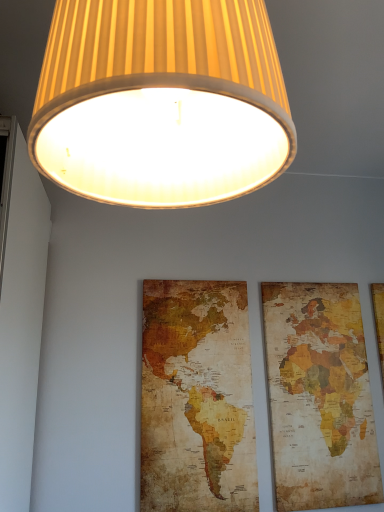
Measure the distance between point (x=360, y=501) and camera.

1.52 meters.

The image size is (384, 512). Describe the element at coordinates (197, 398) in the screenshot. I see `vintage paper map at center` at that location.

I want to click on matte yellow fabric lampshade at upper center, so click(x=161, y=101).

How different are the orientations of matte yellow fabric lampshade at upper center and vintage paper map at center in degrees?

The angle between the facing direction of matte yellow fabric lampshade at upper center and the facing direction of vintage paper map at center is 90.9 degrees.

Is matte yellow fabric lampshade at upper center shorter than vintage paper map at center?

Correct, matte yellow fabric lampshade at upper center is not as tall as vintage paper map at center.

Is matte yellow fabric lampshade at upper center aimed at vintage paper map at center?

No, matte yellow fabric lampshade at upper center is not facing towards vintage paper map at center.

From the image's perspective, is matte yellow fabric lampshade at upper center beneath vintage paper map at center?

No.

Is the surface of vintage paper map at right in direct contact with vintage paper map at center?

No.

From the image's perspective, is vintage paper map at right located above or below vintage paper map at center?

vintage paper map at right is below vintage paper map at center.

From a real-world perspective, is vintage paper map at right below vintage paper map at center?

Correct, in the physical world, vintage paper map at right is lower than vintage paper map at center.

How many degrees apart are the facing directions of vintage paper map at right and vintage paper map at center?

0.936 degrees separate the facing orientations of vintage paper map at right and vintage paper map at center.

Does vintage paper map at right appear on the left side of matte yellow fabric lampshade at upper center?

No, vintage paper map at right is not to the left of matte yellow fabric lampshade at upper center.

Based on the photo, can you confirm if vintage paper map at right is wider than matte yellow fabric lampshade at upper center?

Incorrect, the width of vintage paper map at right does not surpass that of matte yellow fabric lampshade at upper center.

Is point (292, 443) positioned after point (152, 15)?

Yes, point (292, 443) is farther from viewer.

The height and width of the screenshot is (512, 384). In order to click on picture frame beneath the matte yellow fabric lampshade at upper center (from a real-world perspective) in this screenshot , I will do `click(319, 397)`.

Is vintage paper map at center touching vintage paper map at right?

No.

Between vintage paper map at center and vintage paper map at right, which one has more height?

Standing taller between the two is vintage paper map at right.

You are a GUI agent. You are given a task and a screenshot of the screen. Output one action in this format:
    pyautogui.click(x=<x>, y=<y>)
    Task: Click on the picture frame that appears on the right of vintage paper map at center
    Image resolution: width=384 pixels, height=512 pixels.
    Given the screenshot: What is the action you would take?
    pyautogui.click(x=319, y=397)

From the picture: Is vintage paper map at center positioned with its back to vintage paper map at right?

No.

Is matte yellow fabric lampshade at upper center far from vintage paper map at right?

matte yellow fabric lampshade at upper center is positioned a significant distance from vintage paper map at right.

Does matte yellow fabric lampshade at upper center have a larger size compared to vintage paper map at right?

Indeed, matte yellow fabric lampshade at upper center has a larger size compared to vintage paper map at right.

How distant is matte yellow fabric lampshade at upper center from vintage paper map at right?

They are 1.31 meters apart.

Which object is thinner, matte yellow fabric lampshade at upper center or vintage paper map at right?

Thinner between the two is vintage paper map at right.

From a real-world perspective, which is physically below, vintage paper map at center or matte yellow fabric lampshade at upper center?

In real-world perspective, vintage paper map at center is lower.

Which of these two, vintage paper map at center or matte yellow fabric lampshade at upper center, is thinner?

Thinner between the two is vintage paper map at center.

Is vintage paper map at center placed right next to matte yellow fabric lampshade at upper center?

There is a gap between vintage paper map at center and matte yellow fabric lampshade at upper center.

I want to click on map that is on the right side of matte yellow fabric lampshade at upper center, so click(197, 398).

Where is `map in front of the vintage paper map at right`? Image resolution: width=384 pixels, height=512 pixels. map in front of the vintage paper map at right is located at coordinates (197, 398).

Looking at the image, which one is located further to vintage paper map at right, vintage paper map at center or matte yellow fabric lampshade at upper center?

matte yellow fabric lampshade at upper center is positioned further to the anchor vintage paper map at right.

In the scene shown: Based on their spatial positions, is vintage paper map at right or matte yellow fabric lampshade at upper center closer to vintage paper map at center?

Among the two, vintage paper map at right is located nearer to vintage paper map at center.

From the image, which object appears to be farther from matte yellow fabric lampshade at upper center, vintage paper map at right or vintage paper map at center?

vintage paper map at right.

Estimate the real-world distances between objects in this image. Which object is further from vintage paper map at center, matte yellow fabric lampshade at upper center or vintage paper map at right?

matte yellow fabric lampshade at upper center is further to vintage paper map at center.

Based on their spatial positions, is vintage paper map at center or vintage paper map at right further from matte yellow fabric lampshade at upper center?

vintage paper map at right is positioned further to the anchor matte yellow fabric lampshade at upper center.

From the image, which object appears to be farther from vintage paper map at right, matte yellow fabric lampshade at upper center or vintage paper map at center?

Based on the image, matte yellow fabric lampshade at upper center appears to be further to vintage paper map at right.

Identify the location of map located between matte yellow fabric lampshade at upper center and vintage paper map at right in the depth direction. (197, 398).